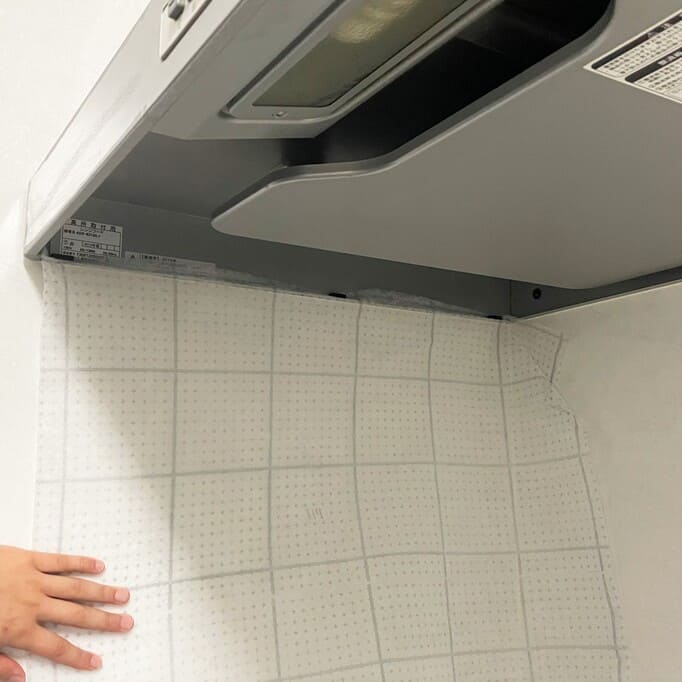
The width and height of the screenshot is (682, 682). Find the location of `vent fan/light fixture control button`. vent fan/light fixture control button is located at coordinates (174, 5).